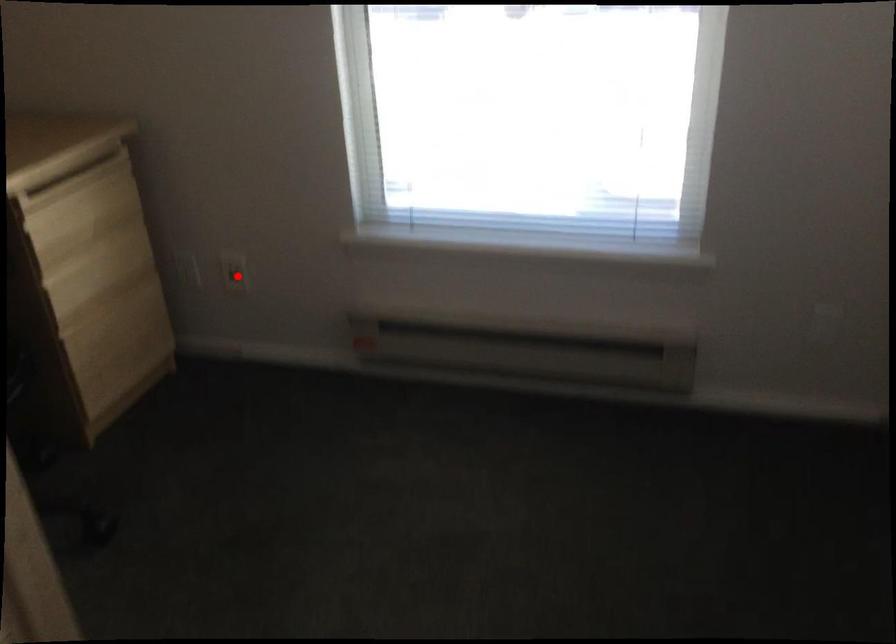
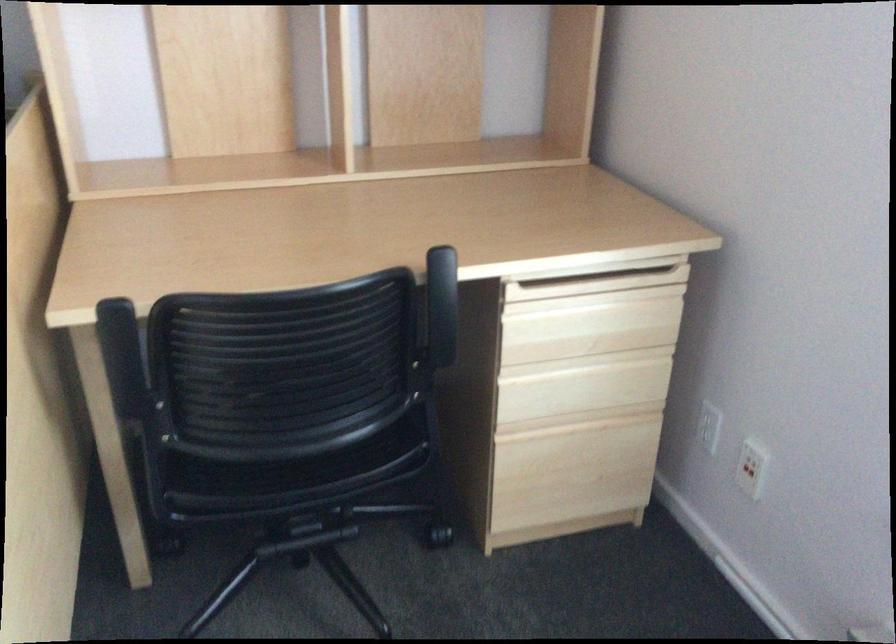
The point at the highlighted location is marked in the first image. Where is the corresponding point in the second image?

(747, 471)